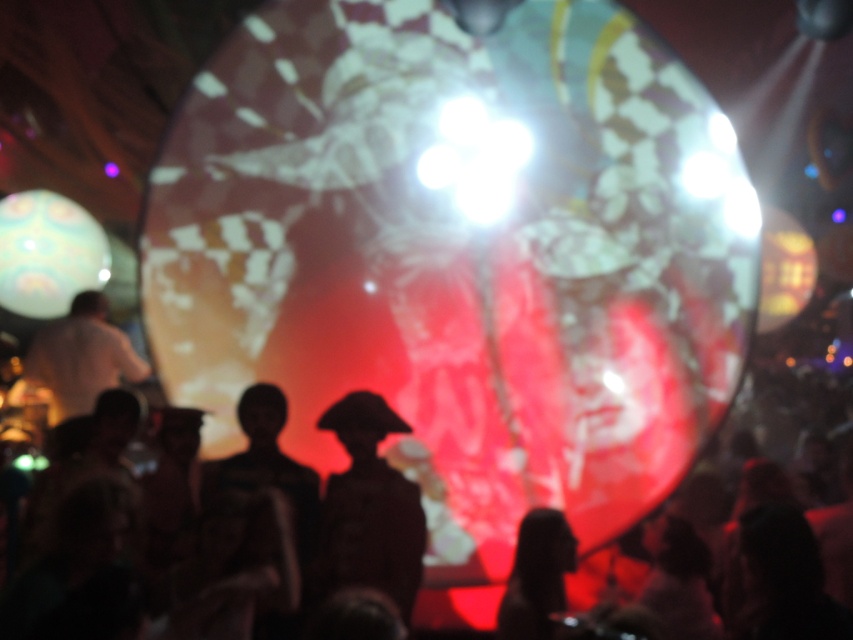
You are standing in the concert venue and notice the dark matte hat at center. Can you determine its exact location using the coordinate system where the bottom left corner is the origin?

The dark matte hat at center is located at the coordinate point of (368, 509).

You are at a concert and see the silhouette crowd at center and the silhouette head at lower center. Which one appears taller from your perspective?

The silhouette crowd at center appears taller than the silhouette head at lower center because it has a greater height compared to it.

You are a photographer at the concert. You want to capture a photo where the silhouette crowd at center and the dark matte hat at center are both visible. Based on their positions, which object should you focus on to ensure both are in the frame?

Since the silhouette crowd at center is above the dark matte hat at center, you should focus on the silhouette crowd at center to ensure both are in the frame as they are vertically aligned.